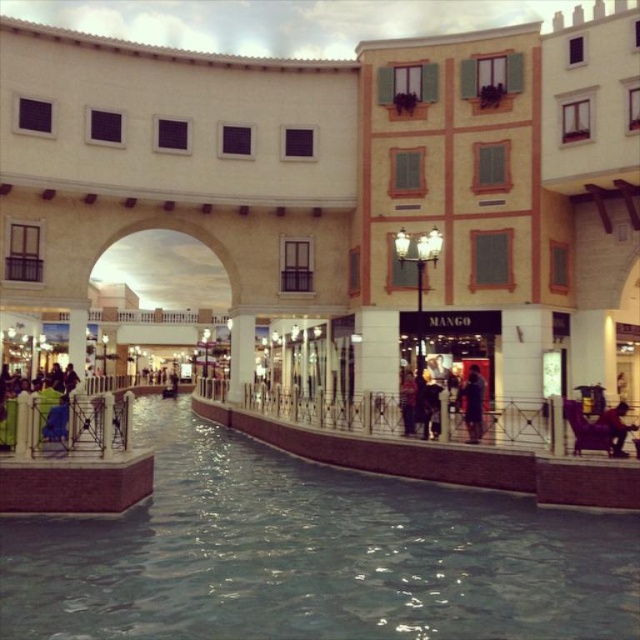
What do you see at coordinates (312, 554) in the screenshot?
I see `clear water at center` at bounding box center [312, 554].

Is clear water at center positioned behind dark brown leather jacket at lower right?

No, clear water at center is closer to the viewer.

Identify the location of clear water at center. (312, 554).

Between point (476, 388) and point (609, 412), which one is positioned behind?

The point (476, 388) is more distant.

Can you confirm if dark blue jeans at center is wider than dark brown leather jacket at lower right?

No, dark blue jeans at center is not wider than dark brown leather jacket at lower right.

Which is behind, point (472, 433) or point (616, 456)?

Point (472, 433)

Image resolution: width=640 pixels, height=640 pixels. What are the coordinates of `dark blue jeans at center` in the screenshot? It's located at (474, 404).

Between clear water at center and dark blue jeans at center, which one is positioned higher?

Positioned higher is dark blue jeans at center.

Between point (173, 508) and point (476, 404), which one is positioned in front?

Point (173, 508) is more forward.

The image size is (640, 640). Identify the location of clear water at center. (312, 554).

This screenshot has height=640, width=640. I want to click on clear water at center, so click(x=312, y=554).